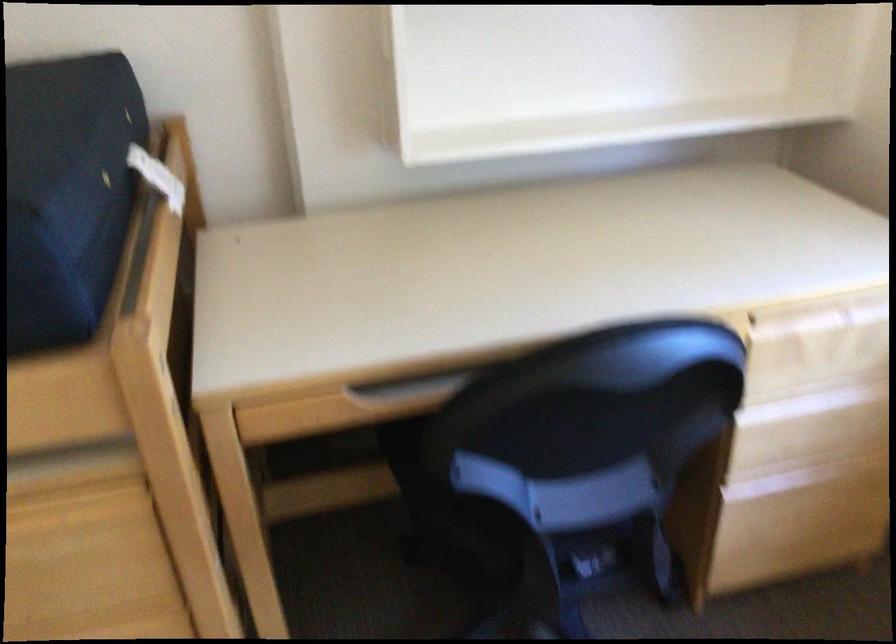
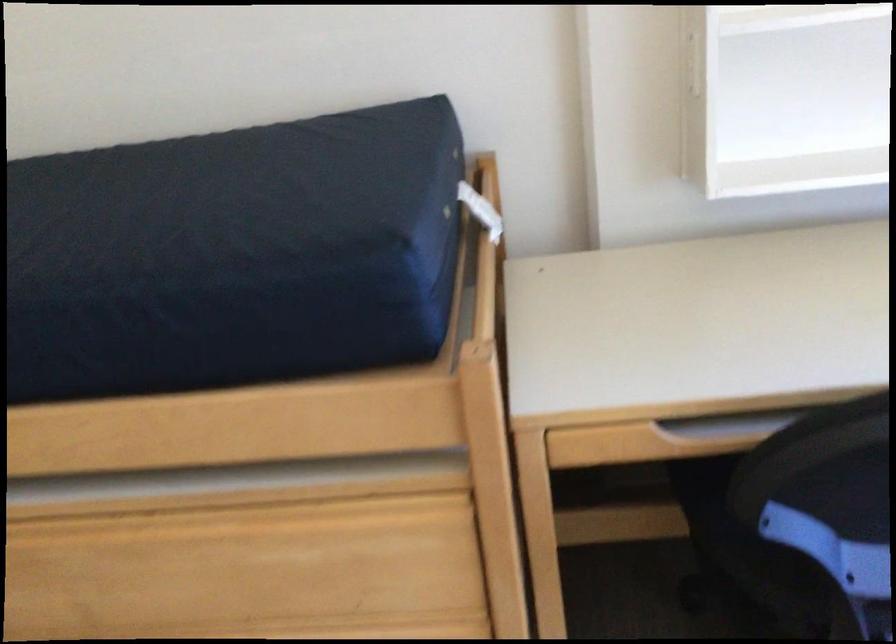
Locate, in the second image, the point that corresponds to (x=161, y=180) in the first image.

(480, 211)